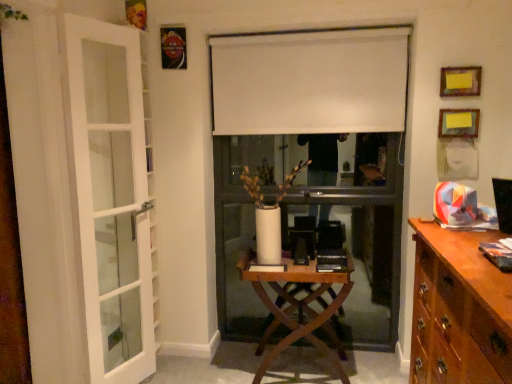
I want to click on wooden picture frame at upper right, which ranks as the 1th picture frame in bottom-to-top order, so click(x=458, y=123).

What do you see at coordinates (298, 307) in the screenshot? Image resolution: width=512 pixels, height=384 pixels. I see `wooden at center` at bounding box center [298, 307].

In order to face wooden at center, should I rotate leftwards or rightwards?

Rotate right and turn 5.328 degrees.

This screenshot has width=512, height=384. In order to click on white matte curtain at center in this screenshot , I will do `click(310, 81)`.

What do you see at coordinates (112, 194) in the screenshot?
I see `white glass door at left` at bounding box center [112, 194].

This screenshot has height=384, width=512. What are the coordinates of `wooden picture frame at upper right, which is the 1th picture frame in top-to-bottom order` in the screenshot? It's located at (460, 81).

Locate an element on the screen. brown wood cabinet at right is located at coordinates (459, 310).

From a real-world perspective, is wooden picture frame at upper right, which appears as the 2th picture frame when ordered from the bottom, positioned over wooden picture frame at upper right, which is the second picture frame from top to bottom, based on gravity?

Yes, from a real-world perspective, wooden picture frame at upper right, which appears as the 2th picture frame when ordered from the bottom, is over wooden picture frame at upper right, which is the second picture frame from top to bottom

From the image's perspective, is wooden picture frame at upper right, which appears as the 2th picture frame when ordered from the bottom, beneath wooden picture frame at upper right, which ranks as the 1th picture frame in bottom-to-top order?

No, from the image's perspective, wooden picture frame at upper right, which appears as the 2th picture frame when ordered from the bottom, is not below wooden picture frame at upper right, which ranks as the 1th picture frame in bottom-to-top order.

Is point (459, 75) farther from viewer compared to point (450, 128)?

No, (459, 75) is in front of (450, 128).

Identify the location of picture frame that appears on the right of wooden picture frame at upper right, which appears as the 2th picture frame when ordered from the bottom. (458, 123).

From a real-world perspective, is brown wood cabinet at right beneath white matte curtain at center?

Yes.

From the image's perspective, who appears lower, brown wood cabinet at right or white matte curtain at center?

brown wood cabinet at right.

Consider the image. Is brown wood cabinet at right taller than white matte curtain at center?

Correct, brown wood cabinet at right is much taller as white matte curtain at center.

At what (x,y) coordinates should I click in order to perform the action: click on curtain located behind the wooden picture frame at upper right, which ranks as the 1th picture frame in bottom-to-top order. Please return your answer as a coordinate pair (x, y). The image size is (512, 384). Looking at the image, I should click on (310, 81).

From a real-world perspective, who is located lower, wooden picture frame at upper right, which is the second picture frame from top to bottom, or white matte curtain at center?

In real-world perspective, wooden picture frame at upper right, which is the second picture frame from top to bottom, is lower.

From the image's perspective, is wooden picture frame at upper right, which ranks as the 1th picture frame in bottom-to-top order, over white matte curtain at center?

Incorrect, from the image's perspective, wooden picture frame at upper right, which ranks as the 1th picture frame in bottom-to-top order, is lower than white matte curtain at center.

Consider the image. Is wooden picture frame at upper right, which ranks as the 1th picture frame in bottom-to-top order, wider or thinner than wooden at center?

Clearly, wooden picture frame at upper right, which ranks as the 1th picture frame in bottom-to-top order, has less width compared to wooden at center.

Which of these two, wooden picture frame at upper right, which ranks as the 1th picture frame in bottom-to-top order, or wooden at center, stands taller?

wooden at center is taller.

Is wooden picture frame at upper right, which ranks as the 1th picture frame in bottom-to-top order, further to camera compared to wooden at center?

Yes, wooden picture frame at upper right, which ranks as the 1th picture frame in bottom-to-top order, is behind wooden at center.

How far apart are wooden picture frame at upper right, which ranks as the 1th picture frame in bottom-to-top order, and wooden at center?

wooden picture frame at upper right, which ranks as the 1th picture frame in bottom-to-top order, is 1.25 meters from wooden at center.

In the image, is white glass door at left positioned in front of or behind wooden at center?

white glass door at left is positioned closer to the viewer than wooden at center.

Can you confirm if white glass door at left is taller than wooden at center?

Yes.

Is white glass door at left wider or thinner than wooden at center?

In the image, white glass door at left appears to be more narrow than wooden at center.

Is white glass door at left not inside wooden at center?

Yes, white glass door at left is not within wooden at center.

Considering the relative sizes of wooden picture frame at upper right, which is the 1th picture frame in top-to-bottom order, and white matte curtain at center in the image provided, is wooden picture frame at upper right, which is the 1th picture frame in top-to-bottom order, bigger than white matte curtain at center?

No, wooden picture frame at upper right, which is the 1th picture frame in top-to-bottom order, is not bigger than white matte curtain at center.

From the image's perspective, which object appears higher, wooden picture frame at upper right, which is the 1th picture frame in top-to-bottom order, or white matte curtain at center?

From the image's view, white matte curtain at center is above.

Does wooden picture frame at upper right, which appears as the 2th picture frame when ordered from the bottom, have a lesser height compared to white matte curtain at center?

Yes, wooden picture frame at upper right, which appears as the 2th picture frame when ordered from the bottom, is shorter than white matte curtain at center.

Does wooden picture frame at upper right, which appears as the 2th picture frame when ordered from the bottom, have a greater width compared to white matte curtain at center?

No, wooden picture frame at upper right, which appears as the 2th picture frame when ordered from the bottom, is not wider than white matte curtain at center.

From the image's perspective, is white matte curtain at center under wooden at center?

No, from the image's perspective, white matte curtain at center is not beneath wooden at center.

In the scene shown: Who is taller, white matte curtain at center or wooden at center?

With more height is wooden at center.

Would you say white matte curtain at center contains wooden at center?

No, wooden at center is not inside white matte curtain at center.

Looking at this image, between white matte curtain at center and wooden at center, which one has larger size?

wooden at center.

This screenshot has width=512, height=384. I want to click on picture frame behind the wooden picture frame at upper right, which appears as the 2th picture frame when ordered from the bottom, so click(458, 123).

The image size is (512, 384). I want to click on curtain on the left of brown wood cabinet at right, so click(310, 81).

When comparing their distances from wooden picture frame at upper right, which appears as the 2th picture frame when ordered from the bottom, does wooden picture frame at upper right, which is the second picture frame from top to bottom, or brown wood cabinet at right seem further?

Based on the image, brown wood cabinet at right appears to be further to wooden picture frame at upper right, which appears as the 2th picture frame when ordered from the bottom.

Estimate the real-world distances between objects in this image. Which object is further from white matte curtain at center, wooden picture frame at upper right, which appears as the 2th picture frame when ordered from the bottom, or white glass door at left?

white glass door at left is positioned further to the anchor white matte curtain at center.

Looking at the image, which one is located closer to brown wood cabinet at right, white matte curtain at center or white glass door at left?

white matte curtain at center is positioned closer to the anchor brown wood cabinet at right.

Looking at the image, which one is located further to white matte curtain at center, wooden at center or wooden picture frame at upper right, which is the second picture frame from top to bottom?

wooden at center is further to white matte curtain at center.

When comparing their distances from wooden picture frame at upper right, which ranks as the 1th picture frame in bottom-to-top order, does wooden at center or white glass door at left seem closer?

wooden at center is positioned closer to the anchor wooden picture frame at upper right, which ranks as the 1th picture frame in bottom-to-top order.

From the image, which object appears to be nearer to wooden picture frame at upper right, which is the 1th picture frame in top-to-bottom order, white matte curtain at center or wooden picture frame at upper right, which ranks as the 1th picture frame in bottom-to-top order?

Based on the image, wooden picture frame at upper right, which ranks as the 1th picture frame in bottom-to-top order, appears to be nearer to wooden picture frame at upper right, which is the 1th picture frame in top-to-bottom order.

Looking at the image, which one is located further to white glass door at left, wooden picture frame at upper right, which appears as the 2th picture frame when ordered from the bottom, or white matte curtain at center?

wooden picture frame at upper right, which appears as the 2th picture frame when ordered from the bottom, lies further to white glass door at left than the other object.

Which object lies further to the anchor point brown wood cabinet at right, wooden at center or white matte curtain at center?

white matte curtain at center.

Find the location of a particular element. This screenshot has width=512, height=384. curtain situated between white glass door at left and wooden picture frame at upper right, which ranks as the 1th picture frame in bottom-to-top order, from left to right is located at coordinates 310,81.

This screenshot has height=384, width=512. Identify the location of desk located between white glass door at left and wooden picture frame at upper right, which appears as the 2th picture frame when ordered from the bottom, in the left-right direction. (298, 307).

Find the location of a particular element. picture frame between white glass door at left and wooden picture frame at upper right, which ranks as the 1th picture frame in bottom-to-top order is located at coordinates (460, 81).

The image size is (512, 384). Find the location of `desk between white glass door at left and brown wood cabinet at right from left to right`. desk between white glass door at left and brown wood cabinet at right from left to right is located at coordinates coord(298,307).